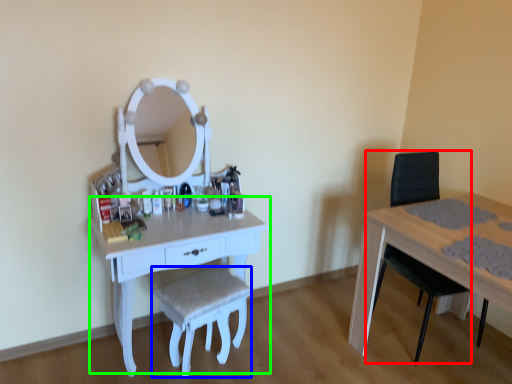
Question: Which is farther away from swivel chair (highlighted by a red box)? stool (highlighted by a blue box) or table (highlighted by a green box)?

Choices:
 (A) stool
 (B) table

Answer: (B)